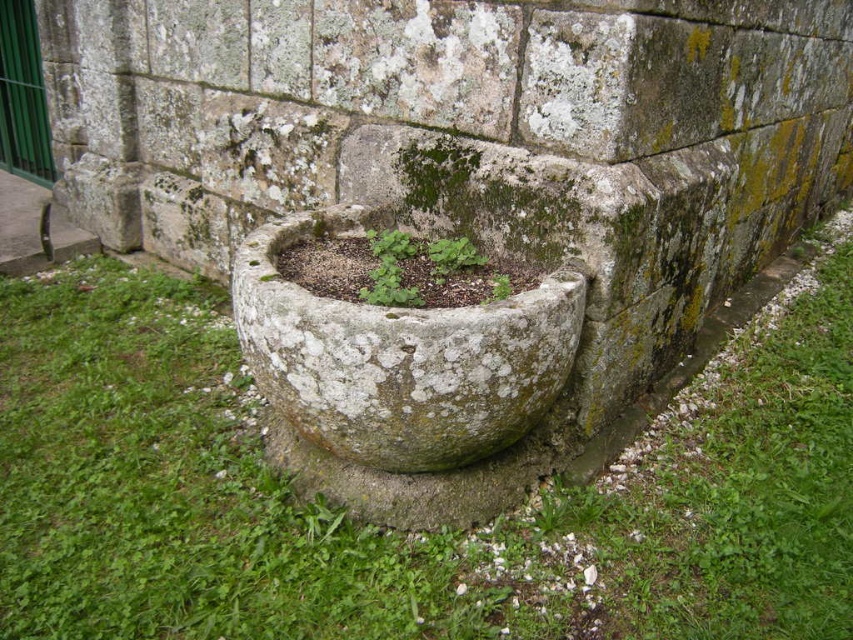
Is point (161, 330) positioned in front of point (392, 282)?

No, (161, 330) is behind (392, 282).

Is point (793, 440) positioned before point (405, 294)?

No.

Find the location of a particular element. The height and width of the screenshot is (640, 853). green mossy stone at center is located at coordinates coord(403,532).